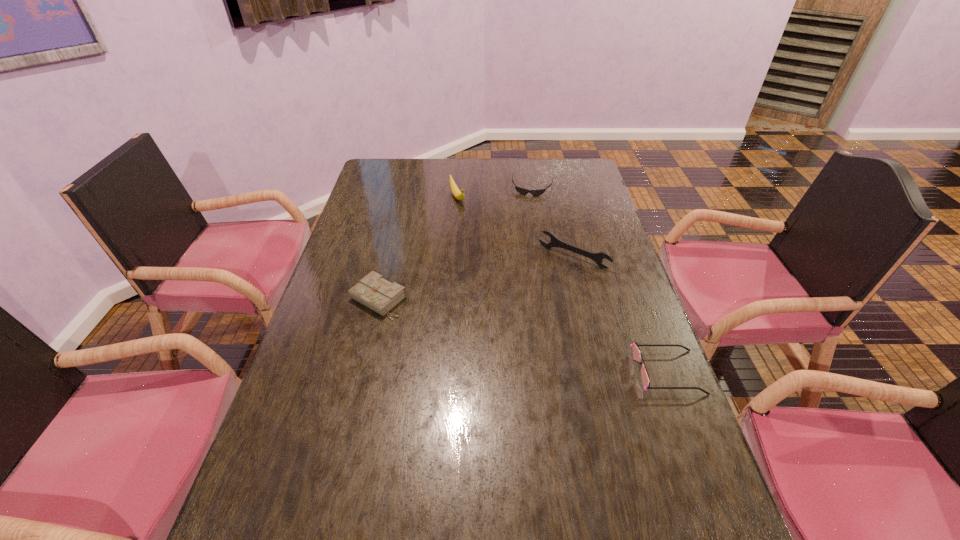
Identify which object is the third closest to the leftmost object. Please provide its 2D coordinates. Your answer should be formatted as a tuple, i.e. [(x, y)], where the tuple contains the x and y coordinates of a point satisfying the conditions above.

[(522, 191)]

Where is `the closest object relative to the banana`? The height and width of the screenshot is (540, 960). the closest object relative to the banana is located at coordinates (522, 191).

You are a GUI agent. You are given a task and a screenshot of the screen. Output one action in this format:
    pyautogui.click(x=<x>, y=<y>)
    Task: Click on the vacant region that satisfies the following two spatial constraints: 1. on the back side of the leftmost object; 2. on the right side of the left sunglasses
    
    Given the screenshot: What is the action you would take?
    pyautogui.click(x=405, y=187)

Where is `free spot that satisfies the following two spatial constraints: 1. on the back side of the shortest object; 2. on the left side of the second nearest object`? Image resolution: width=960 pixels, height=540 pixels. free spot that satisfies the following two spatial constraints: 1. on the back side of the shortest object; 2. on the left side of the second nearest object is located at coordinates (405, 187).

The width and height of the screenshot is (960, 540). In order to click on blank area in the image that satisfies the following two spatial constraints: 1. on the front side of the leftmost object; 2. on the bridge of the nearer sunglasses in this screenshot , I will do `click(360, 372)`.

At what (x,y) coordinates should I click in order to perform the action: click on free space in the image that satisfies the following two spatial constraints: 1. on the back side of the second nearest object; 2. on the left side of the farther sunglasses. Please return your answer as a coordinate pair (x, y). Looking at the image, I should click on (405, 187).

Locate an element on the screen. vacant space that satisfies the following two spatial constraints: 1. on the front side of the nearer sunglasses; 2. on the bridge of the banana is located at coordinates (444, 372).